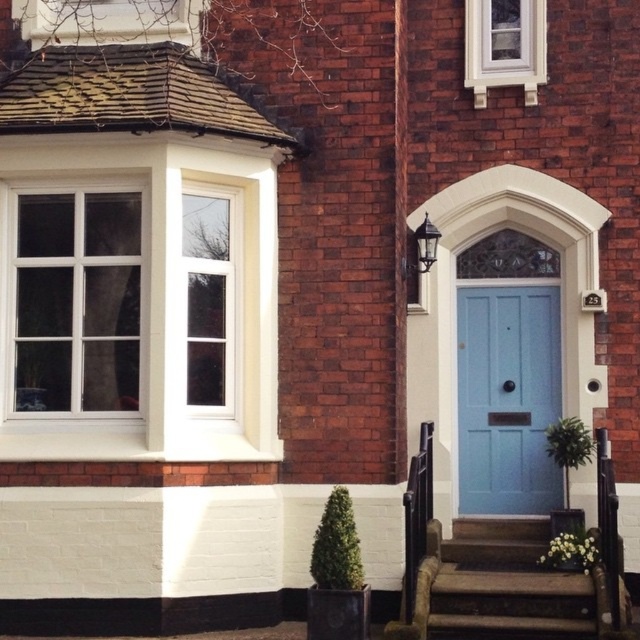
You are a delivery person trying to reach the front door of the house. You see the light blue wooden door at center and the clear glass window at upper left. Based on their positions, which object is located lower in the image?

The light blue wooden door at center is located lower than the clear glass window at upper left because it is positioned below it.

You are standing in front of the brick house and want to know which window is more to the left. You see the clear glass window at upper left and the white painted wood window at upper center. Which one is located further to the left?

The clear glass window at upper left is positioned on the left side of the white painted wood window at upper center, so it is more to the left.

You are a delivery person with a package that requires a 7 feet clearance to pass through the doorway. Can you safely deliver the package through the light blue wooden door at center without hitting the clear glass window at upper left?

The distance between the light blue wooden door at center and the clear glass window at upper left is 8.16 feet, which is greater than the required 7 feet clearance. Therefore, you can safely deliver the package through the light blue wooden door at center without hitting the clear glass window at upper left.